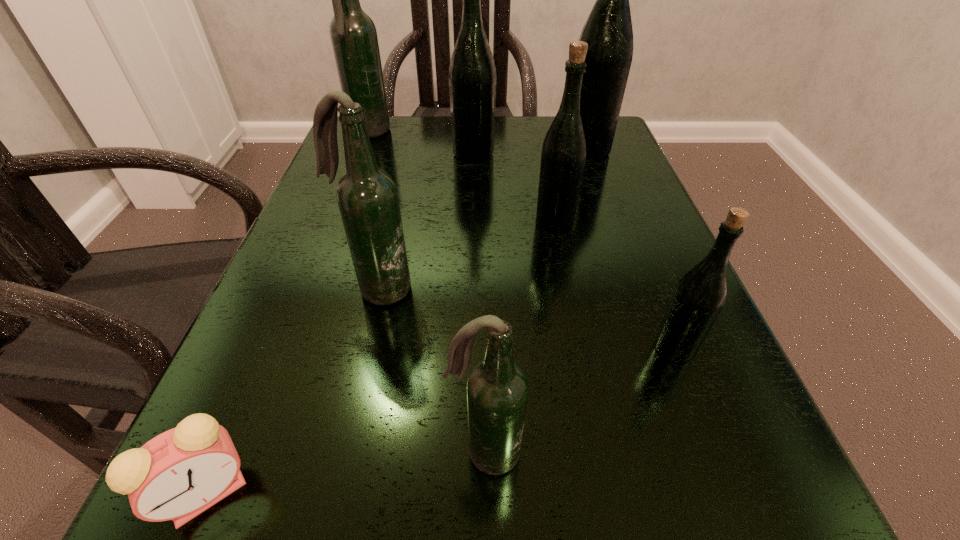
This screenshot has width=960, height=540. In the image, there is a desktop. Find the location of `vacant space at the right edge`. vacant space at the right edge is located at coordinates (601, 229).

Find the location of a particular element. vacant space at the far left corner is located at coordinates (407, 143).

Locate an element on the screen. vacant space at the near left corner of the desktop is located at coordinates pos(299,499).

In the image, there is a desktop. Identify the location of free space at the far right corner. (619, 153).

Where is `free spot between the second nearest beer bottle and the leftmost beer bottle`? The image size is (960, 540). free spot between the second nearest beer bottle and the leftmost beer bottle is located at coordinates (521, 241).

At what (x,y) coordinates should I click in order to perform the action: click on empty location between the sixth farthest beer bottle and the second farthest dark beer bottle. Please return your answer as a coordinate pair (x, y). Looking at the image, I should click on (526, 319).

Find the location of a particular element. free space between the leftmost beer bottle and the second biggest green beer bottle is located at coordinates (421, 144).

The height and width of the screenshot is (540, 960). I want to click on vacant space that is in between the third smallest green beer bottle and the second nearest beer bottle, so click(574, 251).

At what (x,y) coordinates should I click in order to perform the action: click on free space between the pink alarm clock and the second biggest green beer bottle. Please return your answer as a coordinate pair (x, y). Looking at the image, I should click on (341, 323).

The width and height of the screenshot is (960, 540). I want to click on free space between the tallest object and the alarm clock, so click(x=397, y=321).